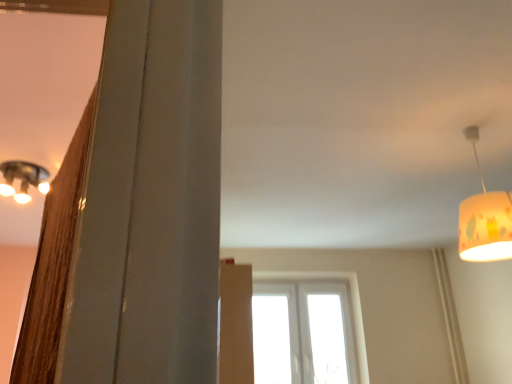
The image size is (512, 384). Describe the element at coordinates (484, 220) in the screenshot. I see `yellow fabric lampshade at upper right` at that location.

Locate an element on the screen. yellow fabric lampshade at upper right is located at coordinates (484, 220).

This screenshot has height=384, width=512. What do you see at coordinates (351, 302) in the screenshot?
I see `transparent glass window at center` at bounding box center [351, 302].

Where is `transparent glass window at center`? transparent glass window at center is located at coordinates (351, 302).

You are a GUI agent. You are given a task and a screenshot of the screen. Output one action in this format:
    pyautogui.click(x=<x>, y=<y>)
    Task: Click on the yellow fabric lampshade at upper right
    The width and height of the screenshot is (512, 384).
    Given the screenshot: What is the action you would take?
    pyautogui.click(x=484, y=220)

Considering the relative positions of transparent glass window at center and yellow fabric lampshade at upper right in the image provided, is transparent glass window at center to the right of yellow fabric lampshade at upper right from the viewer's perspective?

No, transparent glass window at center is not to the right of yellow fabric lampshade at upper right.

Which object is closer to the camera taking this photo, transparent glass window at center or yellow fabric lampshade at upper right?

Positioned in front is yellow fabric lampshade at upper right.

Which is farther from the camera, (338,278) or (480,209)?

Positioned behind is point (338,278).

From the image's perspective, would you say transparent glass window at center is positioned over yellow fabric lampshade at upper right?

No, from the image's perspective, transparent glass window at center is not above yellow fabric lampshade at upper right.

From a real-world perspective, is transparent glass window at center over yellow fabric lampshade at upper right?

No, from a real-world perspective, transparent glass window at center is not on top of yellow fabric lampshade at upper right.

Between transparent glass window at center and yellow fabric lampshade at upper right, which one has larger width?

yellow fabric lampshade at upper right is wider.

From the picture: Considering the relative sizes of transparent glass window at center and yellow fabric lampshade at upper right in the image provided, is transparent glass window at center shorter than yellow fabric lampshade at upper right?

Incorrect, the height of transparent glass window at center does not fall short of that of yellow fabric lampshade at upper right.

Considering the relative sizes of transparent glass window at center and yellow fabric lampshade at upper right in the image provided, is transparent glass window at center bigger than yellow fabric lampshade at upper right?

Correct, transparent glass window at center is larger in size than yellow fabric lampshade at upper right.

Is transparent glass window at center not inside yellow fabric lampshade at upper right?

Yes, transparent glass window at center is not within yellow fabric lampshade at upper right.

Is transparent glass window at center not close to yellow fabric lampshade at upper right?

Yes, transparent glass window at center and yellow fabric lampshade at upper right are located far from each other.

Is transparent glass window at center facing towards yellow fabric lampshade at upper right?

Yes, transparent glass window at center is aimed at yellow fabric lampshade at upper right.

How different are the orientations of transparent glass window at center and yellow fabric lampshade at upper right in degrees?

They differ by 90 degrees in their facing directions.

Where is `window below the yellow fabric lampshade at upper right (from the image's perspective)`? Image resolution: width=512 pixels, height=384 pixels. window below the yellow fabric lampshade at upper right (from the image's perspective) is located at coordinates (351, 302).

Considering the positions of objects yellow fabric lampshade at upper right and transparent glass window at center in the image provided, who is more to the right, yellow fabric lampshade at upper right or transparent glass window at center?

yellow fabric lampshade at upper right.

Which object is closer to the camera, yellow fabric lampshade at upper right or transparent glass window at center?

yellow fabric lampshade at upper right is in front.

Does point (490, 259) appear closer or farther from the camera than point (358, 327)?

Point (490, 259) is closer to the camera than point (358, 327).

Based on the photo, from the image's perspective, is yellow fabric lampshade at upper right above or below transparent glass window at center?

From the image's perspective, yellow fabric lampshade at upper right appears above transparent glass window at center.

From a real-world perspective, does yellow fabric lampshade at upper right stand above transparent glass window at center?

Yes, from a real-world perspective, yellow fabric lampshade at upper right is above transparent glass window at center.

Is yellow fabric lampshade at upper right wider or thinner than transparent glass window at center?

Clearly, yellow fabric lampshade at upper right has more width compared to transparent glass window at center.

Is yellow fabric lampshade at upper right taller than transparent glass window at center?

Incorrect, the height of yellow fabric lampshade at upper right is not larger of that of transparent glass window at center.

Considering the relative sizes of yellow fabric lampshade at upper right and transparent glass window at center in the image provided, is yellow fabric lampshade at upper right smaller than transparent glass window at center?

Indeed, yellow fabric lampshade at upper right has a smaller size compared to transparent glass window at center.

Is yellow fabric lampshade at upper right located outside transparent glass window at center?

Absolutely, yellow fabric lampshade at upper right is external to transparent glass window at center.

Would you say yellow fabric lampshade at upper right is a long distance from transparent glass window at center?

That's right, there is a large distance between yellow fabric lampshade at upper right and transparent glass window at center.

Is yellow fabric lampshade at upper right looking in the opposite direction of transparent glass window at center?

No, yellow fabric lampshade at upper right's orientation is not away from transparent glass window at center.

Identify the location of window on the left of yellow fabric lampshade at upper right. (351, 302).

You are a GUI agent. You are given a task and a screenshot of the screen. Output one action in this format:
    pyautogui.click(x=<x>, y=<y>)
    Task: Click on the window below the yellow fabric lampshade at upper right (from the image's perspective)
    The height and width of the screenshot is (384, 512).
    Given the screenshot: What is the action you would take?
    pyautogui.click(x=351, y=302)

The height and width of the screenshot is (384, 512). Find the location of `lamp above the transparent glass window at center (from a real-world perspective)`. lamp above the transparent glass window at center (from a real-world perspective) is located at coordinates (484, 220).